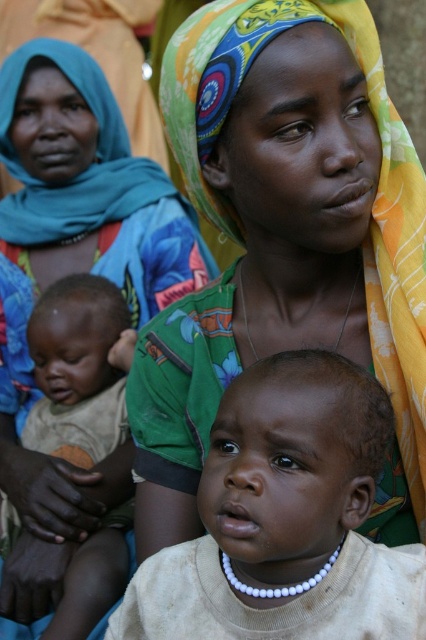
You are standing in the scene and want to reach both point A at coordinates point (x=221, y=124) and point B at coordinates point (x=160, y=576). Which point is closer to you?

Point A at coordinates point (x=221, y=124) is closer to you because it is further to the camera than point B at coordinates point (x=160, y=576).

You are a photographer trying to capture a closeup of the light brown skin baby at center without the matte green scarf at center blocking the view. Based on their positions, can you adjust your angle to see the baby without the scarf?

The matte green scarf at center is located above the light brown skin baby at center, so if you lower your camera angle slightly, you can capture the baby without the scarf blocking the view.